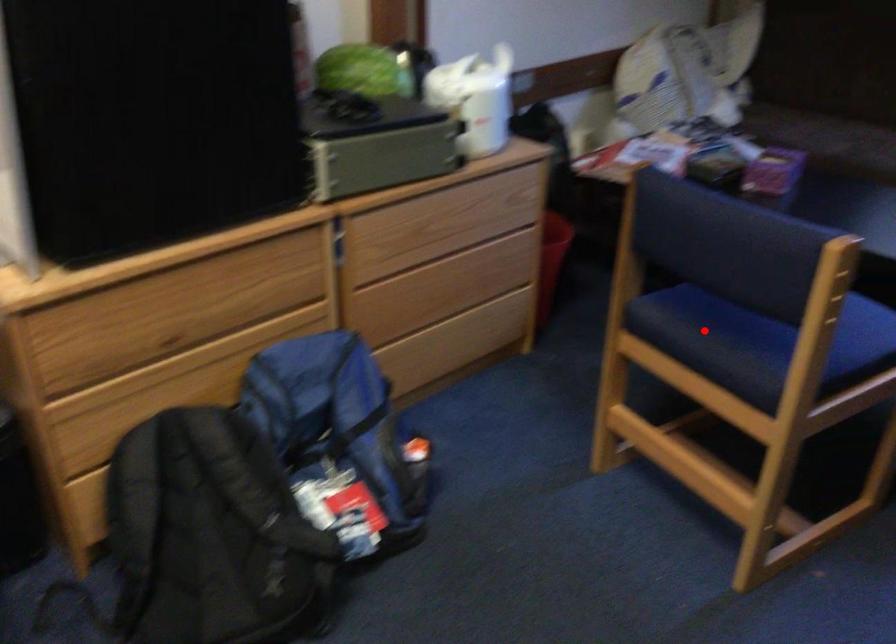
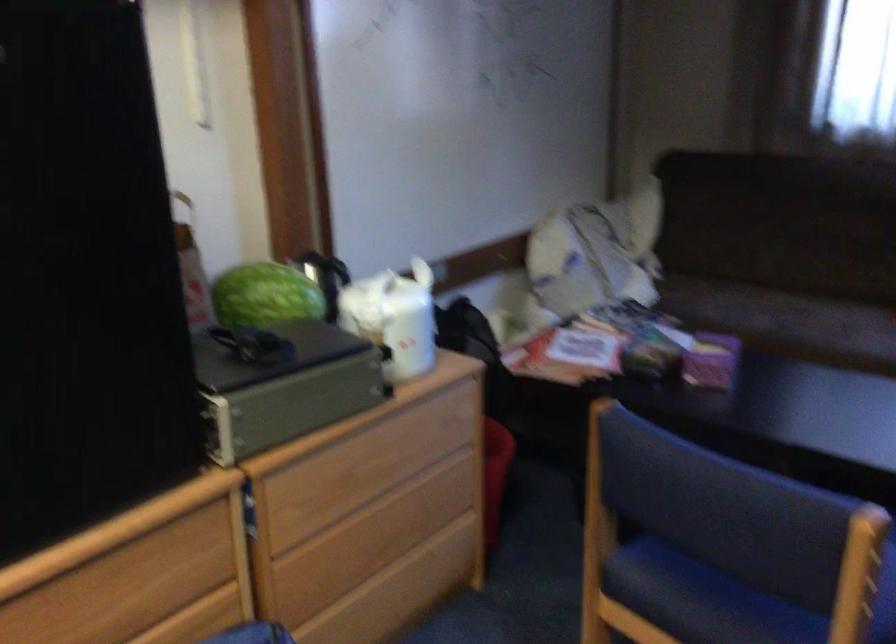
Question: I am providing you with two images of the same scene from different viewpoints. Image1 has a red point marked. In image2, the corresponding 3D location appears at what relative position? Reply with the corresponding letter.

Choices:
 (A) Closer
 (B) Farther

Answer: (A)